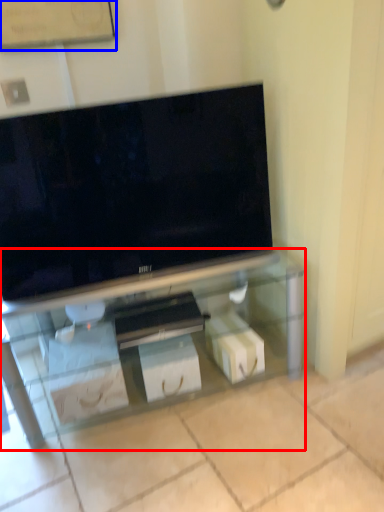
Question: Among these objects, which one is farthest to the camera, furniture (highlighted by a red box) or bulletin board (highlighted by a blue box)?

Choices:
 (A) furniture
 (B) bulletin board

Answer: (B)